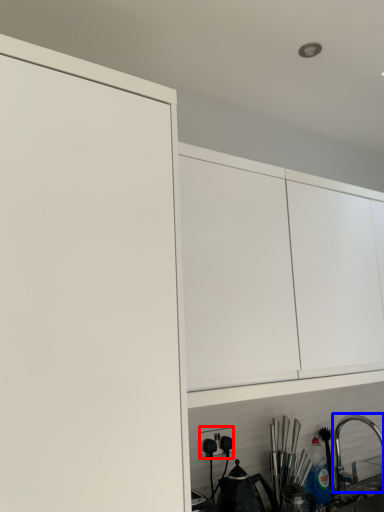
Question: Which object is further to the camera taking this photo, electric outlet (highlighted by a red box) or tap (highlighted by a blue box)?

Choices:
 (A) electric outlet
 (B) tap

Answer: (B)